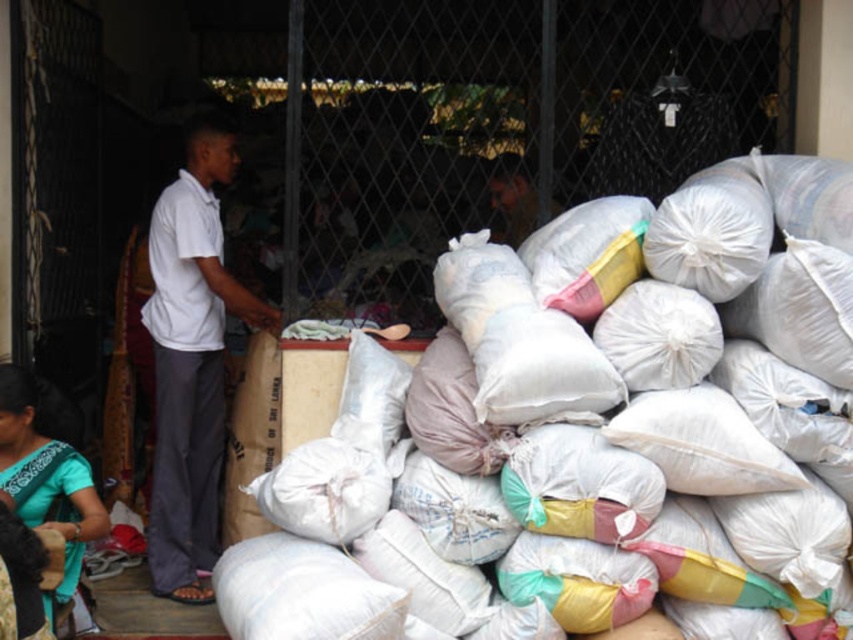
Question: Which of the following is the closest to the observer?

Choices:
 (A) white fabric sack at center
 (B) teal fabric dress at lower left
 (C) white cotton shirt at left

Answer: (A)

Question: Which point is farther to the camera?

Choices:
 (A) white fabric sack at center
 (B) teal fabric dress at lower left

Answer: (B)

Question: Can you confirm if white cotton shirt at left is positioned to the left of teal fabric dress at lower left?

Choices:
 (A) yes
 (B) no

Answer: (B)

Question: Can you confirm if white fabric sack at center is bigger than teal fabric dress at lower left?

Choices:
 (A) no
 (B) yes

Answer: (B)

Question: Based on their relative distances, which object is farther from the teal fabric dress at lower left?

Choices:
 (A) white fabric sack at center
 (B) white cotton shirt at left

Answer: (A)

Question: Is white fabric sack at center smaller than teal fabric dress at lower left?

Choices:
 (A) no
 (B) yes

Answer: (A)